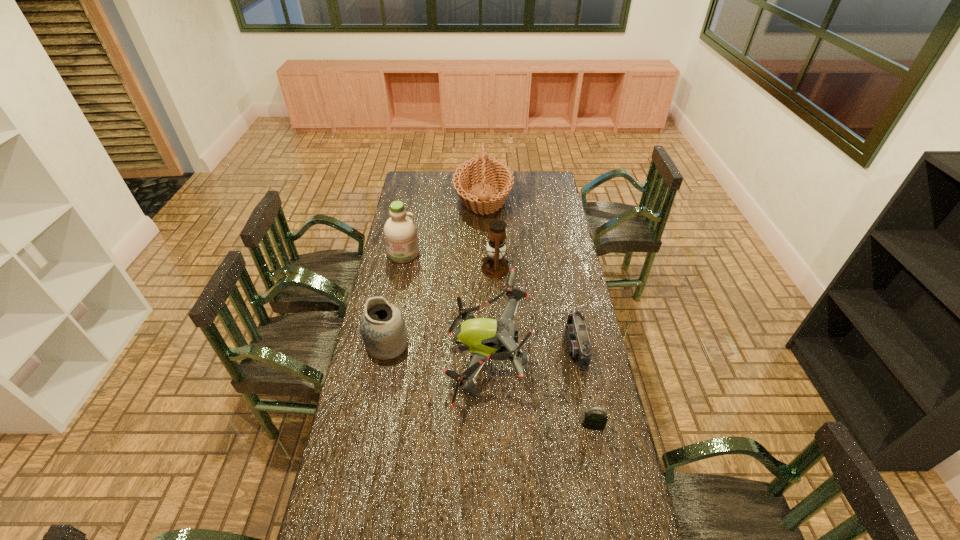
Identify the location of vacant space situated 0.190m on the side of the lantern, there is a wick adjustment knob. Image resolution: width=960 pixels, height=540 pixels. (441, 268).

I want to click on free region located on the front label of the cleansing agent, so click(x=396, y=289).

The width and height of the screenshot is (960, 540). Identify the location of vacant area located on the front-facing side of the drone. (429, 360).

Identify the location of free spot located on the front-facing side of the drone. [403, 360].

Where is `vacant space positioned 0.100m on the front-facing side of the drone`? The image size is (960, 540). vacant space positioned 0.100m on the front-facing side of the drone is located at coordinates (421, 360).

This screenshot has width=960, height=540. I want to click on free region located on the front of the pottery, so click(x=375, y=402).

The image size is (960, 540). I want to click on vacant space positioned 0.060m on the front of the padlock, so click(x=597, y=448).

Find the location of `free spot located on the front-facing side of the camcorder`. free spot located on the front-facing side of the camcorder is located at coordinates (497, 347).

At what (x,y) coordinates should I click in order to perform the action: click on free spot located on the front-facing side of the camcorder. Please return your answer as a coordinate pair (x, y). Looking at the image, I should click on (465, 347).

You are a GUI agent. You are given a task and a screenshot of the screen. Output one action in this format:
    pyautogui.click(x=<x>, y=<y>)
    Task: Click on the free space located on the front-facing side of the camcorder
    
    Given the screenshot: What is the action you would take?
    pyautogui.click(x=494, y=347)